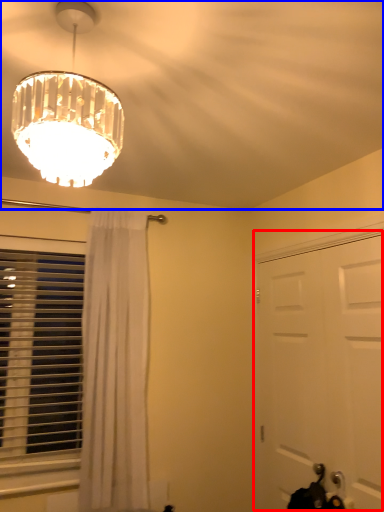
Question: Which point is closer to the camera, door (highlighted by a red box) or fan (highlighted by a blue box)?

Choices:
 (A) door
 (B) fan

Answer: (B)